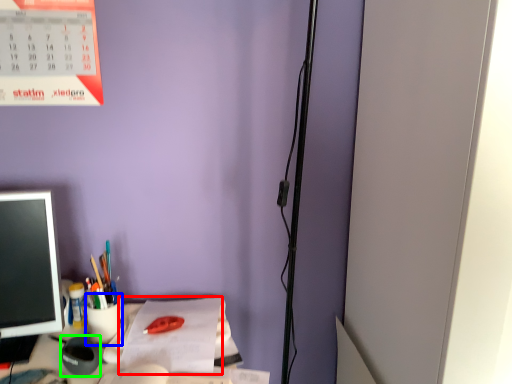
Question: Considering the real-world distances, which object is closest to notebook (highlighted by a red box)? stationery (highlighted by a blue box) or stationery (highlighted by a green box).

Choices:
 (A) stationery
 (B) stationery

Answer: (A)